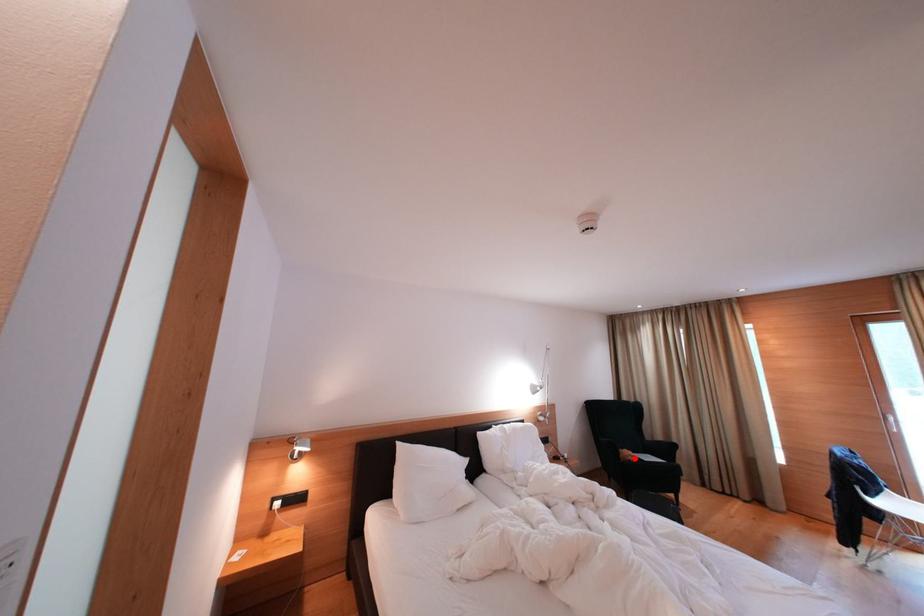
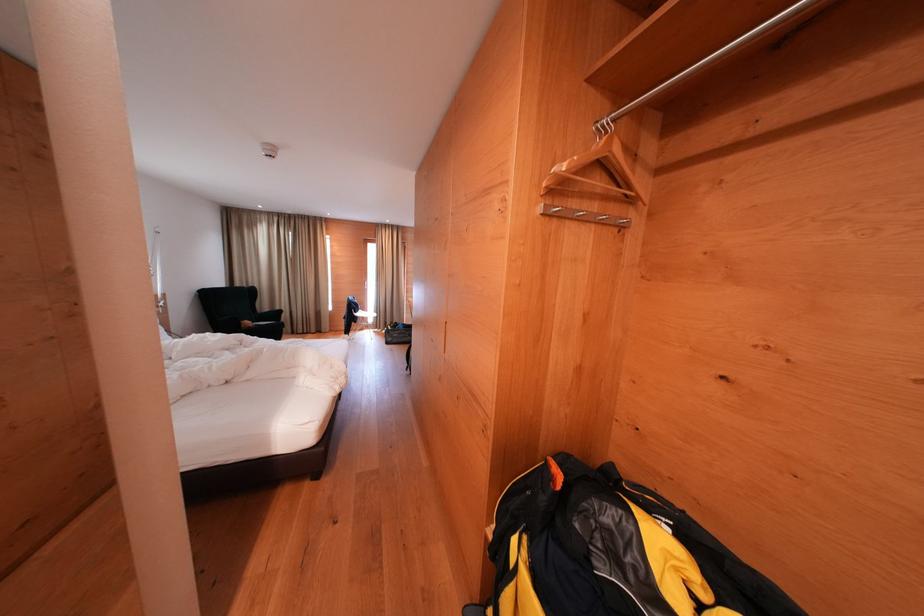
Find the pixel in the second image that matches the highlighted location in the first image.

(254, 328)